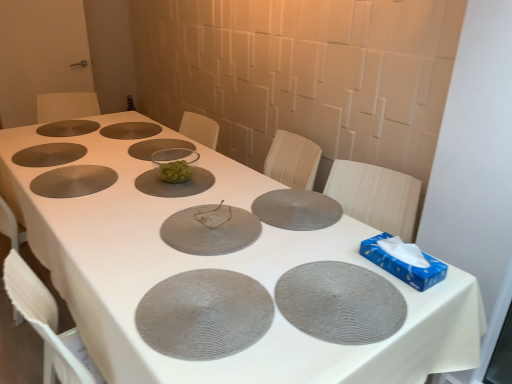
Where is `vacant area that lies between matte gray placemat at left, which appears as the sixth glass plate when viewed from the back, and matte gray glass plate at center, which ranks as the eighth glass plate in back-to-front order`? vacant area that lies between matte gray placemat at left, which appears as the sixth glass plate when viewed from the back, and matte gray glass plate at center, which ranks as the eighth glass plate in back-to-front order is located at coordinates (132, 198).